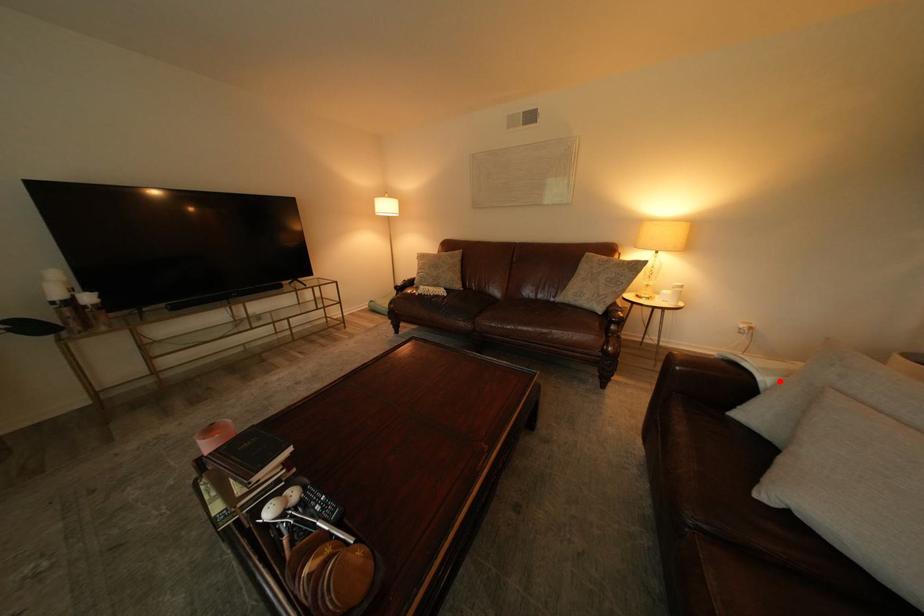
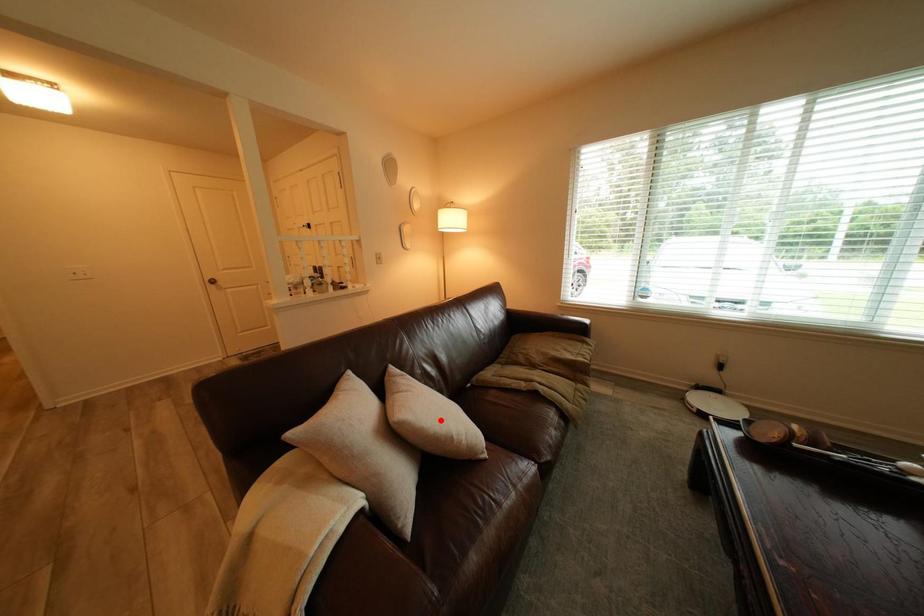
Consider the image. I am providing you with two images of the same scene from different viewpoints. A red point is marked on the first image and another point is marked on the second image. Are the points marked in image1 and image2 representing the same 3D position?

No